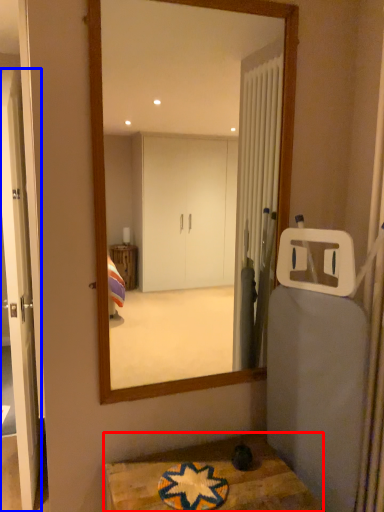
Question: Which point is further to the camera, table (highlighted by a red box) or door (highlighted by a blue box)?

Choices:
 (A) table
 (B) door

Answer: (B)